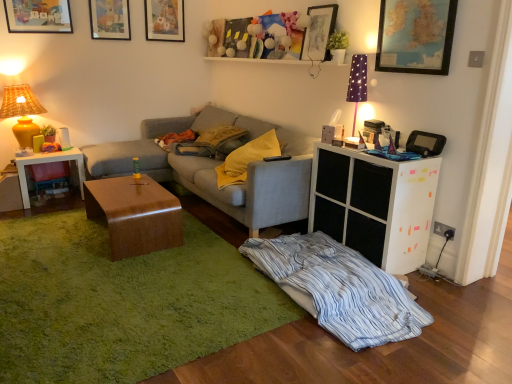
Where is `green shaggy rug at center`? This screenshot has height=384, width=512. green shaggy rug at center is located at coordinates (122, 302).

This screenshot has height=384, width=512. What do you see at coordinates (135, 214) in the screenshot?
I see `glossy wood coffee table at center` at bounding box center [135, 214].

What is the approximate width of matte wooden picture frame at upper center, which is the 5th picture frame from front to back?

matte wooden picture frame at upper center, which is the 5th picture frame from front to back, is 1.31 inches in width.

In order to face matte wooden picture frame at upper center, placed as the 3th picture frame when sorted from right to left, should I rotate leftwards or rightwards?

To align with it, rotate left about 11.840°.

Measure the distance between point (360, 80) and camera.

Point (360, 80) and camera are 2.98 meters apart.

What are the coordinates of `white plastic side table at left` in the screenshot? It's located at (49, 162).

Between yellow corduroy pillow at center, acting as the 1th pillow starting from the front, and blue striped fabric at lower center, which one appears on the left side from the viewer's perspective?

Positioned to the left is yellow corduroy pillow at center, acting as the 1th pillow starting from the front.

From a real-world perspective, is yellow corduroy pillow at center, acting as the 1th pillow starting from the front, positioned under blue striped fabric at lower center based on gravity?

No, from a real-world perspective, yellow corduroy pillow at center, acting as the 1th pillow starting from the front, is not below blue striped fabric at lower center.

Between yellow corduroy pillow at center, acting as the 1th pillow starting from the front, and blue striped fabric at lower center, which one has smaller width?

yellow corduroy pillow at center, acting as the 1th pillow starting from the front, is thinner.

Is matte gray couch at center not near matte wooden picture frame at upper center, which is the 5th picture frame from front to back?

Yes, matte gray couch at center and matte wooden picture frame at upper center, which is the 5th picture frame from front to back, are quite far apart.

From the image's perspective, between matte gray couch at center and matte wooden picture frame at upper center, which is the 5th picture frame from front to back, which one is located above?

From the image's view, matte wooden picture frame at upper center, which is the 5th picture frame from front to back, is above.

Is matte gray couch at center turned away from matte wooden picture frame at upper center, arranged as the third picture frame when viewed from the left?

No, matte gray couch at center is not facing away from matte wooden picture frame at upper center, arranged as the third picture frame when viewed from the left.

Considering the sizes of objects matte wooden picture frame at upper center, the 1th picture frame from the back, and wooden picture frame at upper center, placed as the fourth picture frame when sorted from left to right, in the image provided, who is thinner, matte wooden picture frame at upper center, the 1th picture frame from the back, or wooden picture frame at upper center, placed as the fourth picture frame when sorted from left to right,?

matte wooden picture frame at upper center, the 1th picture frame from the back, is thinner.

Who is shorter, matte wooden picture frame at upper center, placed as the 3th picture frame when sorted from right to left, or wooden picture frame at upper center, which is counted as the second picture frame, starting from the front?

With less height is wooden picture frame at upper center, which is counted as the second picture frame, starting from the front.

Considering the relative positions of matte wooden picture frame at upper center, placed as the 3th picture frame when sorted from right to left, and wooden picture frame at upper center, placed as the fourth picture frame when sorted from left to right, in the image provided, is matte wooden picture frame at upper center, placed as the 3th picture frame when sorted from right to left, behind wooden picture frame at upper center, placed as the fourth picture frame when sorted from left to right,?

That is True.

From the image's perspective, which is above, matte wooden picture frame at upper center, which is the 5th picture frame from front to back, or wooden picture frame at upper center, the 2th picture frame positioned from the right?

matte wooden picture frame at upper center, which is the 5th picture frame from front to back, is shown above in the image.

From a real-world perspective, relative to glossy wood coffee table at center, is matte wooden picture frame at upper left, the first picture frame positioned from the left, vertically above or below?

matte wooden picture frame at upper left, the first picture frame positioned from the left, is above glossy wood coffee table at center.

From the image's perspective, which is below, matte wooden picture frame at upper left, the fifth picture frame when ordered from right to left, or glossy wood coffee table at center?

glossy wood coffee table at center is shown below in the image.

Is point (23, 12) closer to camera compared to point (168, 236)?

That is False.

Between point (311, 190) and point (276, 148), which one is positioned in front?

The point (311, 190) is closer to the camera.

In the image, is white matte cabinet at right positioned in front of or behind yellow corduroy pillow at center, which is counted as the 2th pillow, starting from the back?

white matte cabinet at right is in front of yellow corduroy pillow at center, which is counted as the 2th pillow, starting from the back.

Does white matte cabinet at right have a greater width compared to yellow corduroy pillow at center, which is counted as the 2th pillow, starting from the back?

No, white matte cabinet at right is not wider than yellow corduroy pillow at center, which is counted as the 2th pillow, starting from the back.

From a real-world perspective, relative to yellow corduroy pillow at center, which is counted as the 2th pillow, starting from the back, is white matte cabinet at right vertically above or below?

white matte cabinet at right is below yellow corduroy pillow at center, which is counted as the 2th pillow, starting from the back.

Is blue striped fabric at lower center wider than wooden map at upper right, which is the 1th picture frame from right to left?

Yes, blue striped fabric at lower center is wider than wooden map at upper right, which is the 1th picture frame from right to left.

Which is in front, blue striped fabric at lower center or wooden map at upper right, which is the fifth picture frame in left-to-right order?

blue striped fabric at lower center is in front.

From the picture: Does blue striped fabric at lower center have a smaller size compared to wooden map at upper right, which is the fifth picture frame in left-to-right order?

Incorrect, blue striped fabric at lower center is not smaller in size than wooden map at upper right, which is the fifth picture frame in left-to-right order.

Could you tell me if white plastic side table at left is turned towards white matte cabinet at right?

No, white plastic side table at left is not oriented towards white matte cabinet at right.

From their relative heights in the image, would you say white plastic side table at left is taller or shorter than white matte cabinet at right?

In the image, white plastic side table at left appears to be shorter than white matte cabinet at right.

Is white plastic side table at left at the left side of white matte cabinet at right?

Indeed, white plastic side table at left is positioned on the left side of white matte cabinet at right.

What are the coordinates of `bed that is on the right side of yellow corduroy pillow at center, which is counted as the 2th pillow, starting from the back` in the screenshot? It's located at point(339,289).

You are a GUI agent. You are given a task and a screenshot of the screen. Output one action in this format:
    pyautogui.click(x=<x>, y=<y>)
    Task: Click on the studio couch beneath the matte wooden picture frame at upper center, the 1th picture frame from the back (from a real-world perspective)
    
    Given the screenshot: What is the action you would take?
    pyautogui.click(x=215, y=171)

Which object lies nearer to the anchor point white matte cabinet at right, blue striped fabric at lower center or matte paper picture frame at upper center, positioned as the 4th picture frame in right-to-left order?

Based on the image, blue striped fabric at lower center appears to be nearer to white matte cabinet at right.

Estimate the real-world distances between objects in this image. Which object is further from white plastic side table at left, white matte cabinet at right or matte wooden picture frame at upper left, the first picture frame positioned from the left?

white matte cabinet at right.

Which object lies further to the anchor point purple fabric lampshade at upper right, placed as the first table lamp when sorted from right to left, blue striped fabric at lower center or wooden map at upper right, which is the 1th picture frame from right to left?

blue striped fabric at lower center is further to purple fabric lampshade at upper right, placed as the first table lamp when sorted from right to left.

Looking at the image, which one is located further to blue striped fabric at lower center, matte wooden picture frame at upper center, arranged as the third picture frame when viewed from the left, or green shaggy rug at center?

matte wooden picture frame at upper center, arranged as the third picture frame when viewed from the left, is positioned further to the anchor blue striped fabric at lower center.

Considering their positions, is blue striped fabric at lower center positioned closer to purple fabric lampshade at upper right, which is counted as the first table lamp, starting from the front, than white matte cabinet at right?

white matte cabinet at right is positioned closer to the anchor purple fabric lampshade at upper right, which is counted as the first table lamp, starting from the front.

Looking at the image, which one is located closer to matte wooden picture frame at upper left, the fifth picture frame when ordered from right to left, white matte cabinet at right or green shaggy rug at center?

green shaggy rug at center.

From the image, which object appears to be farther from matte wooden picture frame at upper left, the first picture frame positioned from the left, white plastic side table at left or white matte cabinet at right?

white matte cabinet at right.

Looking at the image, which one is located further to white matte cabinet at right, purple fabric lampshade at upper right, which appears as the 2th table lamp when viewed from the left, or glossy wood coffee table at center?

The object further to white matte cabinet at right is glossy wood coffee table at center.

The width and height of the screenshot is (512, 384). Identify the location of studio couch between matte yellow ceramic lamp at left, the first table lamp in the back-to-front sequence, and yellow fabric pillow at center, which is the 1th pillow from back to front, in the horizontal direction. (215, 171).

The image size is (512, 384). I want to click on studio couch between green shaggy rug at center and matte wooden picture frame at upper left, marked as the 3th picture frame in a back-to-front arrangement, along the z-axis, so click(x=215, y=171).

Locate an element on the screen. Image resolution: width=512 pixels, height=384 pixels. plain between glossy wood coffee table at center and blue striped fabric at lower center in the horizontal direction is located at coordinates (122, 302).

Locate an element on the screen. The height and width of the screenshot is (384, 512). studio couch between matte paper picture frame at upper center, the 2th picture frame from the back, and glossy wood coffee table at center, in the vertical direction is located at coordinates (215, 171).